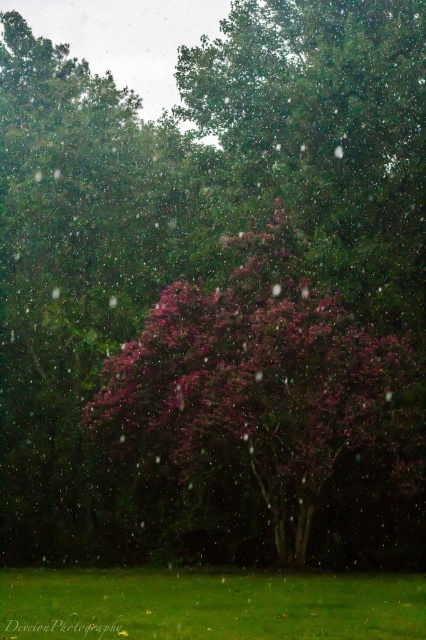
You are standing in the snow scene and want to take a photo of the pink matte flower at center and the green grass at lower center. Which object will appear larger in your photo?

The pink matte flower at center will appear larger in the photo because it is closer to the viewer than the green grass at lower center.

You are a photographer wanting to capture the pink matte flower at center and the green grass at lower center in a single frame. Given that the camera can only focus on one object at a time, which object should you focus on to ensure the larger one is sharp?

The pink matte flower at center is larger in size than the green grass at lower center. Therefore, you should focus on the pink matte flower at center to ensure the larger object is sharp.

You are a photographer trying to capture the pink matte flower at center and the green grass at lower center in your shot. Which object will appear narrower in the photo?

The pink matte flower at center is thinner than the green grass at lower center, so it will appear narrower in the photo.